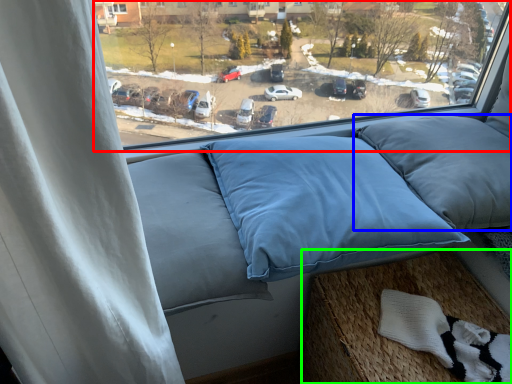
Question: Which object is positioned closest to window (highlighted by a red box)? Select from pillow (highlighted by a blue box) and bed frame (highlighted by a green box).

Choices:
 (A) pillow
 (B) bed frame

Answer: (A)